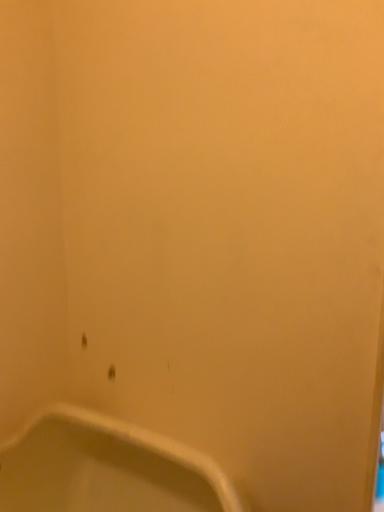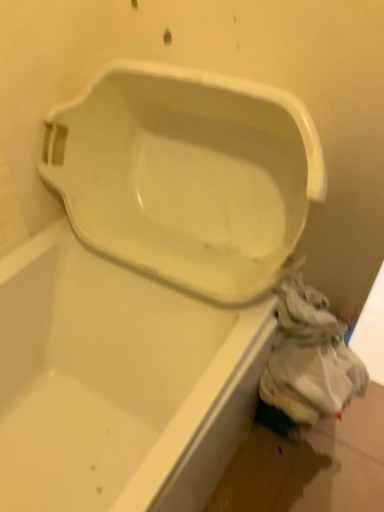
Question: Which way did the camera rotate in the video?

Choices:
 (A) rotated downward
 (B) rotated upward

Answer: (A)